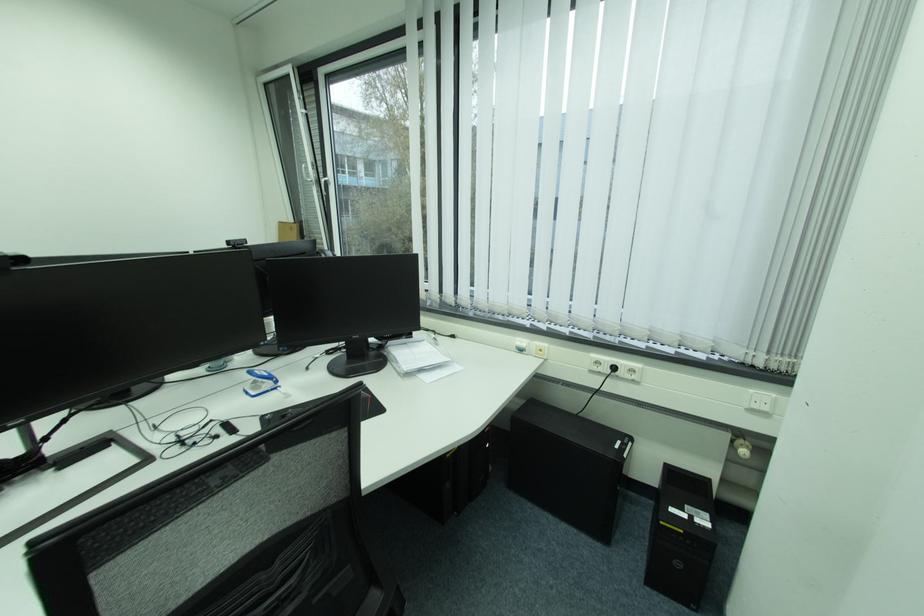
The height and width of the screenshot is (616, 924). Identify the location of black webcam. (13, 261).